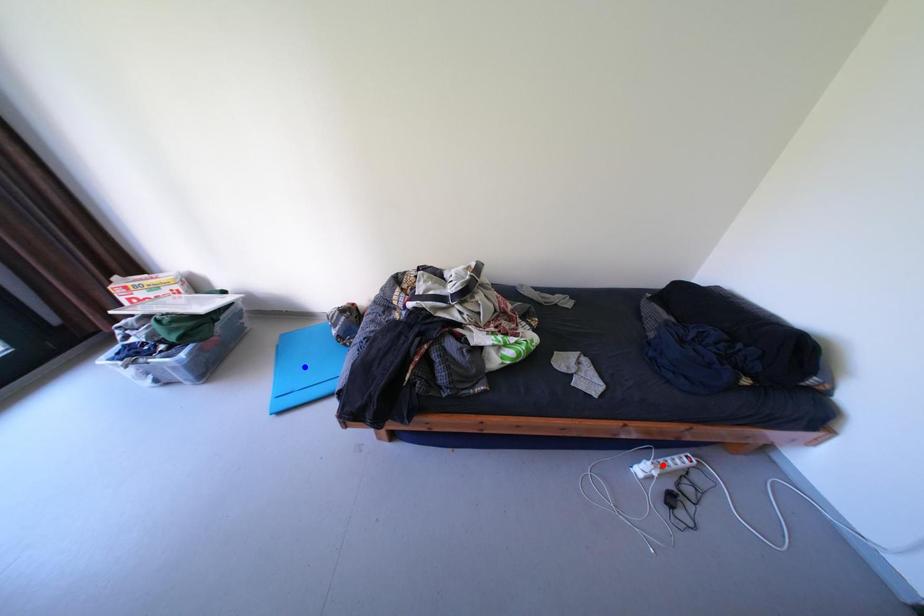
Question: Which of the two points in the image is closer to the camera?

Choices:
 (A) Blue point is closer.
 (B) Red point is closer.

Answer: (B)